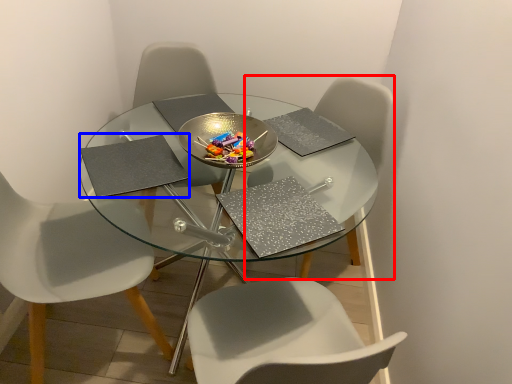
Question: Which object appears farthest to the camera in this image, chair (highlighted by a red box) or pad (highlighted by a blue box)?

Choices:
 (A) chair
 (B) pad

Answer: (A)